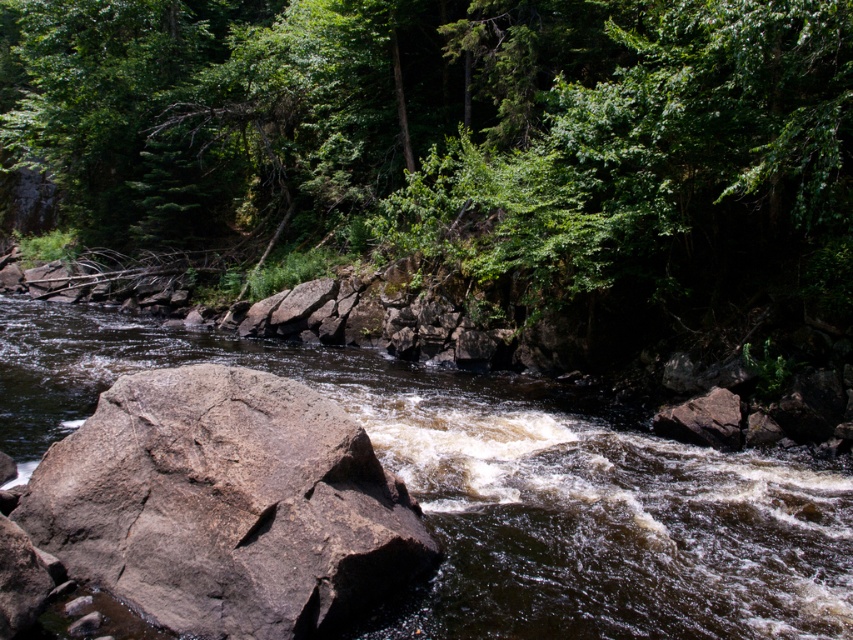
Question: Which of the following is the closest to the observer?

Choices:
 (A) (428, 28)
 (B) (288, 422)
 (C) (502, 417)

Answer: (B)

Question: Among these points, which one is nearest to the camera?

Choices:
 (A) (253, 372)
 (B) (428, 198)

Answer: (A)

Question: Does brown rock at center have a smaller size compared to gray rough rock at center?

Choices:
 (A) yes
 (B) no

Answer: (B)

Question: Is green leafy tree at upper center above gray rough rock at center?

Choices:
 (A) yes
 (B) no

Answer: (A)

Question: Which of the following is the closest to the observer?

Choices:
 (A) green leafy tree at upper center
 (B) brown rock at center

Answer: (B)

Question: Is green leafy tree at upper center thinner than brown rock at center?

Choices:
 (A) yes
 (B) no

Answer: (B)